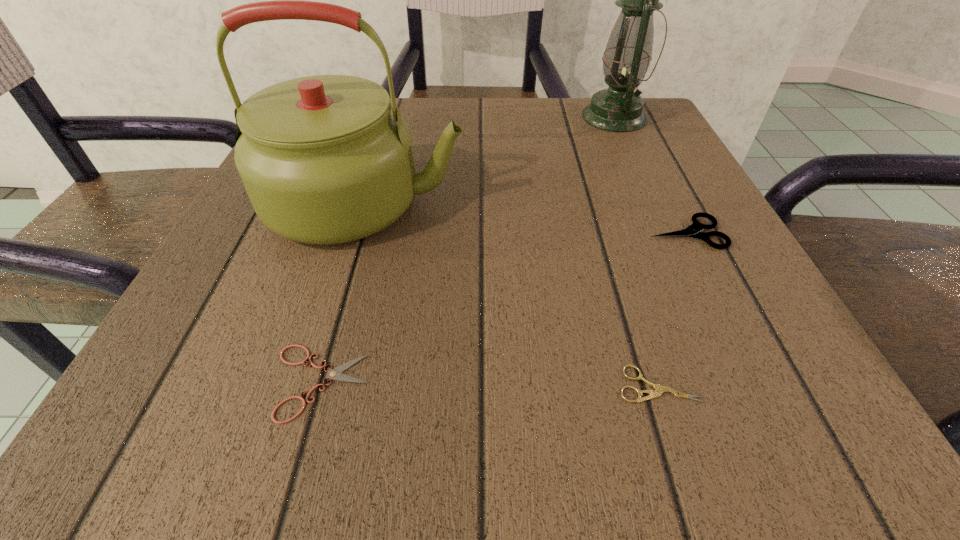
In order to click on the farthest object in this screenshot , I will do `click(628, 53)`.

Find the location of a particular element. Image resolution: width=960 pixels, height=540 pixels. kettle is located at coordinates (324, 159).

Find the location of a particular element. the third shortest object is located at coordinates (694, 230).

At what (x,y) coordinates should I click in order to perform the action: click on the tallest shears. Please return your answer as a coordinate pair (x, y). The image size is (960, 540). Looking at the image, I should click on coord(694,230).

You are a GUI agent. You are given a task and a screenshot of the screen. Output one action in this format:
    pyautogui.click(x=<x>, y=<y>)
    Task: Click on the second shears from left to right
    The height and width of the screenshot is (540, 960).
    Given the screenshot: What is the action you would take?
    pyautogui.click(x=659, y=389)

The width and height of the screenshot is (960, 540). In order to click on the leftmost shears in this screenshot , I will do `click(336, 374)`.

Locate an element on the screen. vacant space situated on the front of the oil lamp is located at coordinates (654, 206).

Find the location of `free spot located at the spout of the kettle`. free spot located at the spout of the kettle is located at coordinates (664, 203).

I want to click on vacant space located 0.350m on the left of the farthest shears, so click(412, 233).

Find the location of a particular element. This screenshot has height=540, width=960. vacant region located on the left of the second shears from right to left is located at coordinates (269, 384).